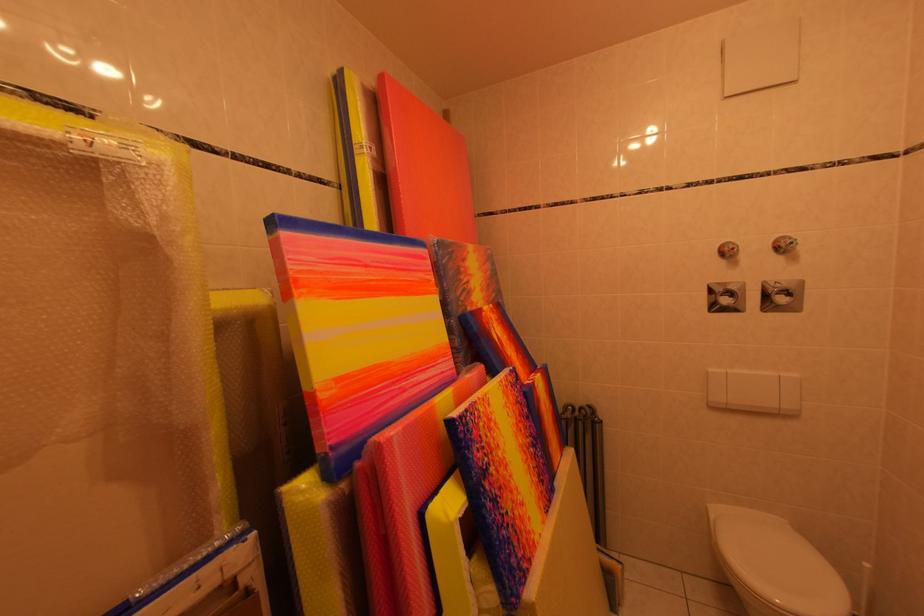
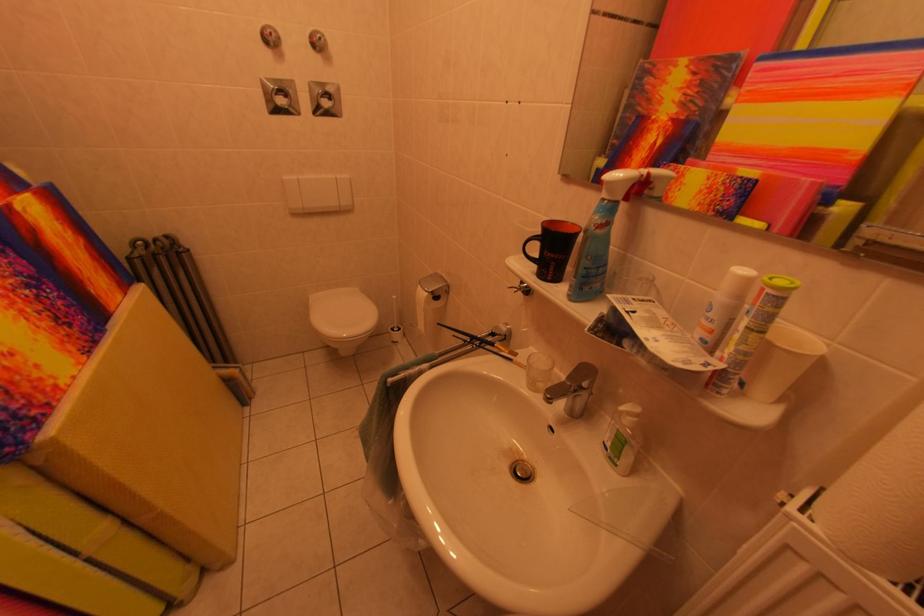
Where in the second image is the point corresponding to the point at 793,300 from the first image?

(334, 103)